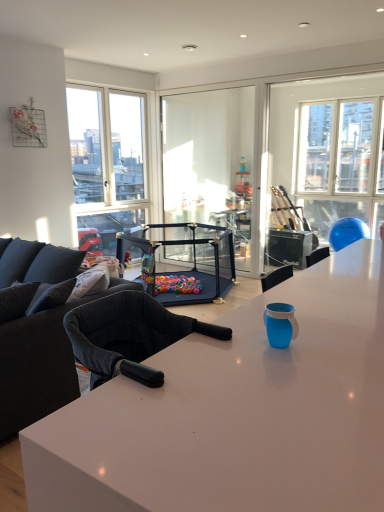
Question: Does transparent glass window at upper right have a lesser height compared to black plastic playpen at center?

Choices:
 (A) no
 (B) yes

Answer: (A)

Question: Does transparent glass window at upper right have a smaller size compared to black plastic playpen at center?

Choices:
 (A) yes
 (B) no

Answer: (A)

Question: Is black plastic playpen at center completely or partially inside transparent glass window at upper right?

Choices:
 (A) no
 (B) yes

Answer: (A)

Question: Is transparent glass window at upper right completely or partially outside of black plastic playpen at center?

Choices:
 (A) no
 (B) yes

Answer: (B)

Question: From a real-world perspective, is transparent glass window at upper right located beneath black plastic playpen at center?

Choices:
 (A) no
 (B) yes

Answer: (A)

Question: From the image's perspective, does transparent glass window at upper right appear lower than black plastic playpen at center?

Choices:
 (A) no
 (B) yes

Answer: (A)

Question: Is transparent glass window at upper right directly adjacent to black fabric couch at left?

Choices:
 (A) no
 (B) yes

Answer: (A)

Question: Does transparent glass window at upper right have a lesser height compared to black fabric couch at left?

Choices:
 (A) yes
 (B) no

Answer: (B)

Question: Is transparent glass window at upper right to the left of black fabric couch at left from the viewer's perspective?

Choices:
 (A) no
 (B) yes

Answer: (A)

Question: From a real-world perspective, does transparent glass window at upper right stand above black fabric couch at left?

Choices:
 (A) yes
 (B) no

Answer: (A)

Question: Is black fabric couch at left surrounded by transparent glass window at upper right?

Choices:
 (A) yes
 (B) no

Answer: (B)

Question: From a real-world perspective, does transparent glass window at upper right sit lower than black fabric couch at left?

Choices:
 (A) no
 (B) yes

Answer: (A)

Question: Is the depth of white glossy desk at center greater than that of black plastic playpen at center?

Choices:
 (A) yes
 (B) no

Answer: (B)